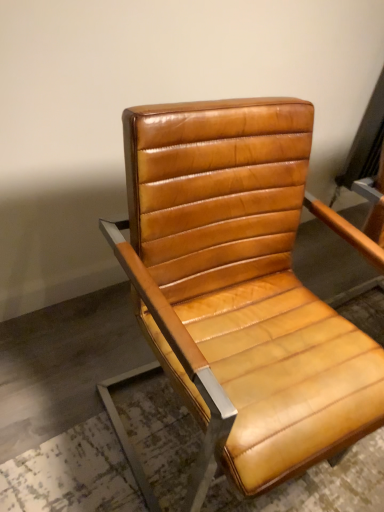
You are a GUI agent. You are given a task and a screenshot of the screen. Output one action in this format:
    pyautogui.click(x=<x>, y=<y>)
    Task: Click on the matte leather chair at center
    The height and width of the screenshot is (512, 384).
    Given the screenshot: What is the action you would take?
    pyautogui.click(x=241, y=288)

From the picture: What is the approximate width of matte leather chair at center?

matte leather chair at center is 23.94 inches in width.

Describe the element at coordinates (241, 288) in the screenshot. I see `matte leather chair at center` at that location.

This screenshot has height=512, width=384. I want to click on matte leather chair at center, so click(x=241, y=288).